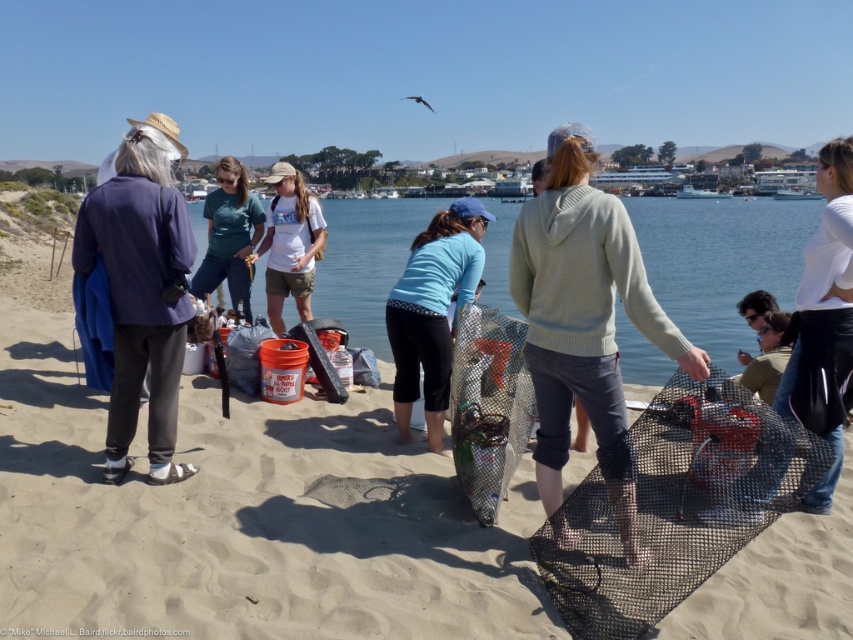
Question: Is light gray sweater at center behind blue fabric shirt at center?

Choices:
 (A) no
 (B) yes

Answer: (A)

Question: Which is nearer to the white matte shirt at upper right?

Choices:
 (A) clear plastic net at center
 (B) green fabric shirt at lower right
 (C) matte green t-shirt at center
 (D) blue fabric shirt at center

Answer: (B)

Question: Is white matte shirt at upper right thinner than green fabric shirt at lower right?

Choices:
 (A) yes
 (B) no

Answer: (B)

Question: Among these objects, which one is nearest to the camera?

Choices:
 (A) clear plastic bucket at center
 (B) white cotton t-shirt at center
 (C) dark blue fabric jacket at left
 (D) matte green t-shirt at center

Answer: (A)

Question: Which point is closer to the camera taking this photo?

Choices:
 (A) (556, 195)
 (B) (838, 148)
 (C) (780, 326)

Answer: (A)

Question: Is clear plastic bucket at center in front of white cotton t-shirt at center?

Choices:
 (A) no
 (B) yes

Answer: (B)